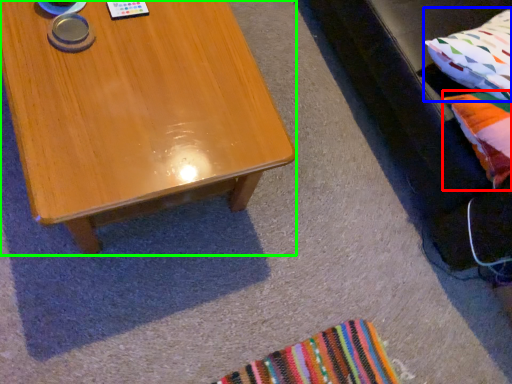
Question: Estimate the real-world distances between objects in this image. Which object is farther from pillow (highlighted by a red box), pillow (highlighted by a blue box) or coffee table (highlighted by a green box)?

Choices:
 (A) pillow
 (B) coffee table

Answer: (B)